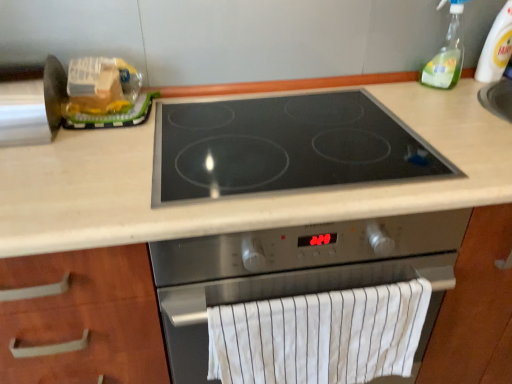
Where is `free space in front of clear plastic bottle at upper right`? The height and width of the screenshot is (384, 512). free space in front of clear plastic bottle at upper right is located at coordinates (455, 104).